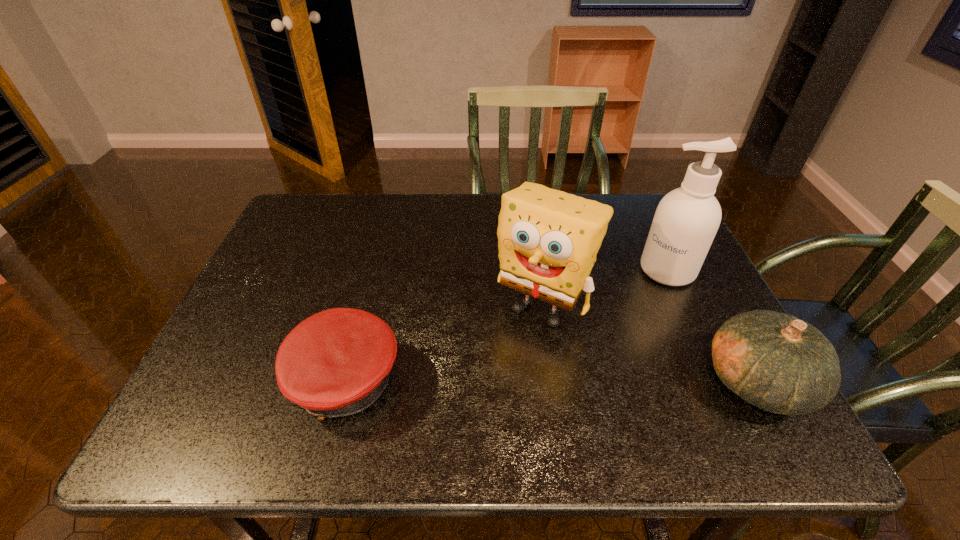
I want to click on object that is at the near right corner, so click(781, 364).

Locate an element on the screen. This screenshot has height=540, width=960. vacant space at the far edge of the desktop is located at coordinates tap(399, 221).

Locate an element on the screen. free spot at the near edge of the desktop is located at coordinates (547, 399).

This screenshot has width=960, height=540. In order to click on vacant space at the left edge in this screenshot , I will do `click(285, 322)`.

In the image, there is a desktop. Identify the location of vacant region at the right edge. (683, 294).

Where is `vacant space at the far left corner of the desktop`? Image resolution: width=960 pixels, height=540 pixels. vacant space at the far left corner of the desktop is located at coordinates (324, 194).

In the image, there is a desktop. Where is `free space at the near left corner`? free space at the near left corner is located at coordinates (206, 397).

This screenshot has height=540, width=960. I want to click on free region at the far right corner of the desktop, so click(x=630, y=211).

The image size is (960, 540). I want to click on free space between the cleansing agent and the cap, so click(x=505, y=326).

Find the location of `empty space that is in between the second tallest object and the tallest object`. empty space that is in between the second tallest object and the tallest object is located at coordinates (605, 287).